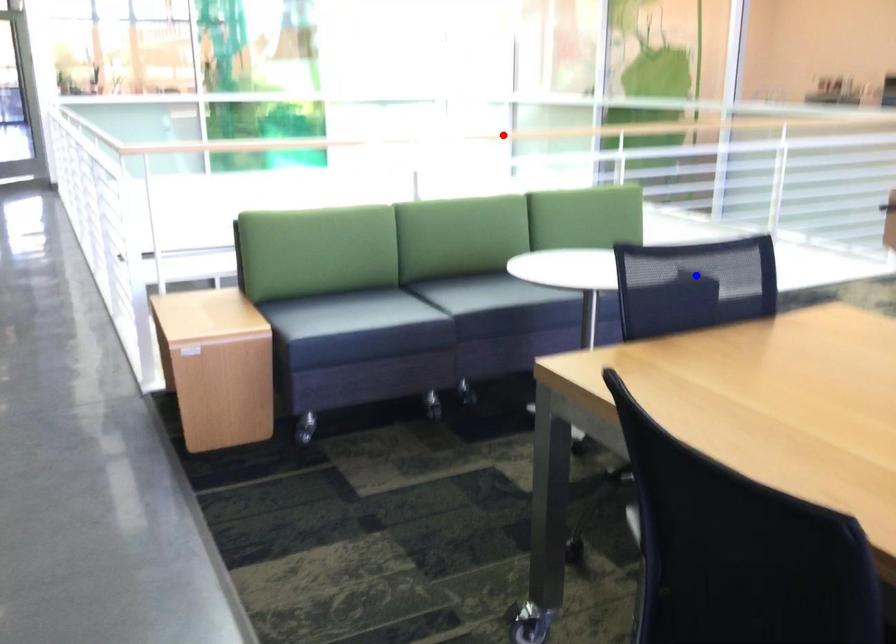
Question: Which of the two points in the image is closer to the camera?

Choices:
 (A) Blue point is closer.
 (B) Red point is closer.

Answer: (A)